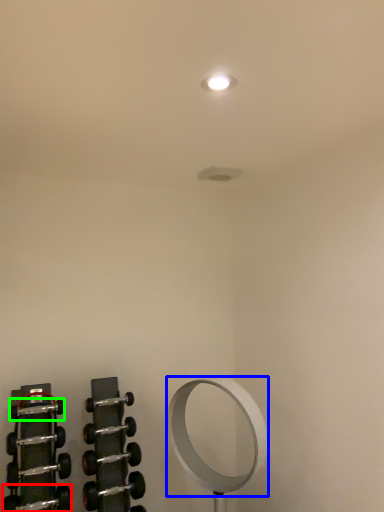
Question: Which is nearer to the dumbbell (highlighted by a red box)? mirror (highlighted by a blue box) or dumbbell (highlighted by a green box).

Choices:
 (A) mirror
 (B) dumbbell

Answer: (B)